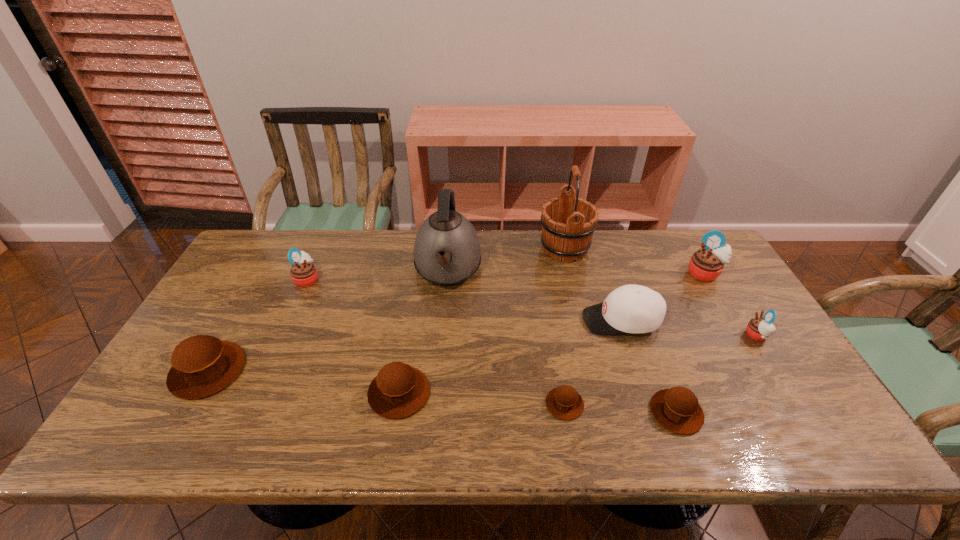
At what (x,y) coordinates should I click in order to perform the action: click on unoccupied position between the smallest pink muffin and the tallest muffin. Please return your answer as a coordinate pair (x, y). Looking at the image, I should click on (731, 305).

Identify the location of vacant area between the gray kettle and the second brown muffin from left to right. (423, 332).

In order to click on vacant area that lies between the white baseball cap and the second smallest brown muffin in this screenshot , I will do `click(649, 366)`.

I want to click on free space between the wine bucket and the gray kettle, so click(506, 260).

The height and width of the screenshot is (540, 960). In order to click on unoccupied position between the gray kettle and the biggest brown muffin in this screenshot , I will do `click(328, 321)`.

Where is `empty space that is in between the wine bucket and the gray kettle`? empty space that is in between the wine bucket and the gray kettle is located at coordinates click(x=506, y=260).

Image resolution: width=960 pixels, height=540 pixels. I want to click on vacant point located between the ninth tallest object and the second muffin from left to right, so click(x=492, y=346).

Where is `vacant space in between the fourth muffin from right to left and the white baseball cap`? This screenshot has width=960, height=540. vacant space in between the fourth muffin from right to left and the white baseball cap is located at coordinates (593, 362).

Where is `empty location between the biggest pink muffin and the second smallest brown muffin`? The image size is (960, 540). empty location between the biggest pink muffin and the second smallest brown muffin is located at coordinates (690, 343).

Where is `empty location between the second biggest brown muffin and the third biggest brown muffin`? empty location between the second biggest brown muffin and the third biggest brown muffin is located at coordinates (538, 403).